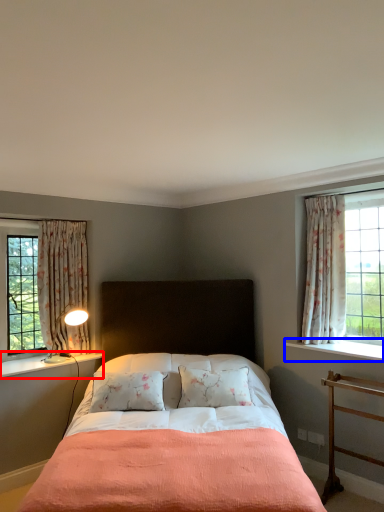
Question: Which object appears farthest to the camera in this image, window sill (highlighted by a red box) or window sill (highlighted by a blue box)?

Choices:
 (A) window sill
 (B) window sill

Answer: (A)